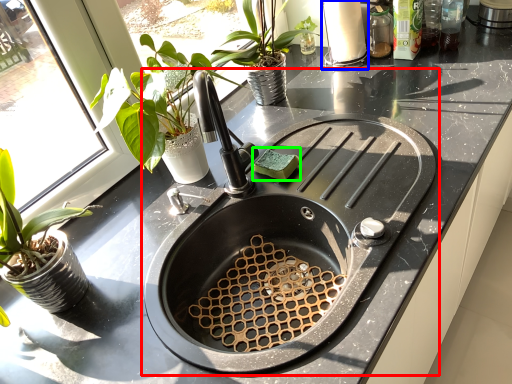
Question: Considering the real-world distances, which object is closest to sink (highlighted by a red box)? appliance (highlighted by a blue box) or food (highlighted by a green box).

Choices:
 (A) appliance
 (B) food

Answer: (B)